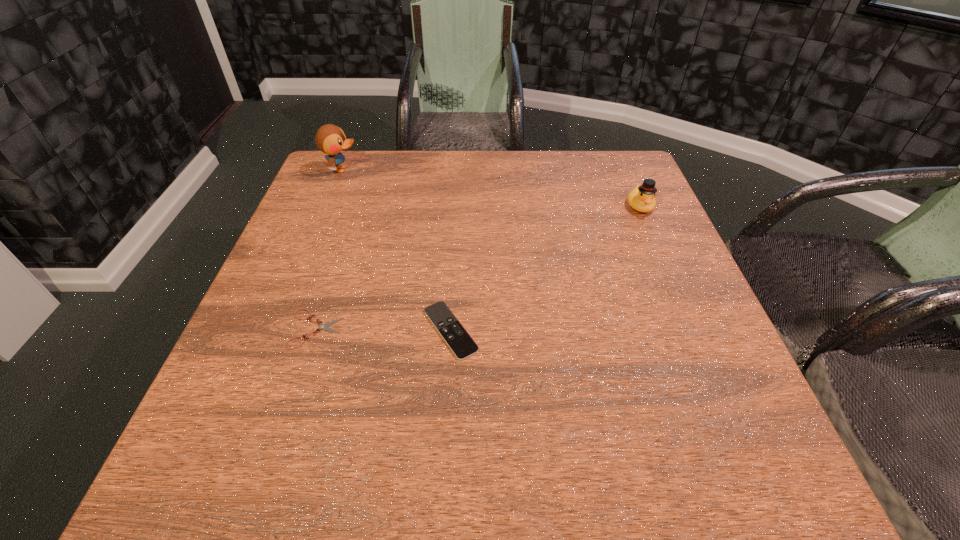
At what (x,y) coordinates should I click in order to perform the action: click on empty location between the shortest object and the third nearest object. Please return your answer as a coordinate pair (x, y). Looking at the image, I should click on (478, 267).

The width and height of the screenshot is (960, 540). I want to click on object that is the nearest to the third tallest object, so click(324, 327).

Select which object appears as the closest to the shortest object. Please provide its 2D coordinates. Your answer should be formatted as a tuple, i.e. [(x, y)], where the tuple contains the x and y coordinates of a point satisfying the conditions above.

[(462, 345)]

The height and width of the screenshot is (540, 960). What are the coordinates of `vacant area that satisfies the following two spatial constraints: 1. on the front-facing side of the taller duck; 2. on the right side of the remote control` in the screenshot? It's located at (276, 330).

At what (x,y) coordinates should I click in order to perform the action: click on free spot that satisfies the following two spatial constraints: 1. on the front-facing side of the remote control; 2. on the right side of the tallest object. Please return your answer as a coordinate pair (x, y). The width and height of the screenshot is (960, 540). Looking at the image, I should click on (276, 330).

The image size is (960, 540). Identify the location of free space that satisfies the following two spatial constraints: 1. on the back side of the remote control; 2. on the front-facing side of the farther duck. (460, 170).

Where is `free spot that satisfies the following two spatial constraints: 1. on the front-facing side of the left duck; 2. on the back side of the shears`? free spot that satisfies the following two spatial constraints: 1. on the front-facing side of the left duck; 2. on the back side of the shears is located at coordinates (276, 329).

Image resolution: width=960 pixels, height=540 pixels. I want to click on blank area in the image that satisfies the following two spatial constraints: 1. on the front-facing side of the shears; 2. on the left side of the left duck, so click(x=276, y=329).

Image resolution: width=960 pixels, height=540 pixels. What are the coordinates of `free location that satisfies the following two spatial constraints: 1. on the front-facing side of the shortest object; 2. on the left side of the left duck` in the screenshot? It's located at (276, 329).

You are a GUI agent. You are given a task and a screenshot of the screen. Output one action in this format:
    pyautogui.click(x=<x>, y=<y>)
    Task: Click on the free space in the image that satisfies the following two spatial constraints: 1. on the front-facing side of the farthest object; 2. on the back side of the shortest object
    This screenshot has height=540, width=960.
    Given the screenshot: What is the action you would take?
    pyautogui.click(x=276, y=329)